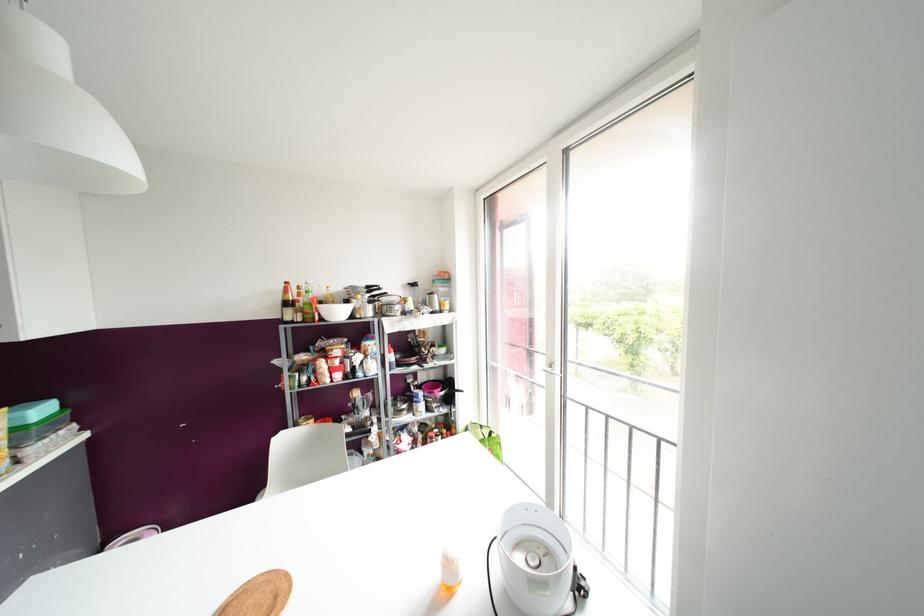
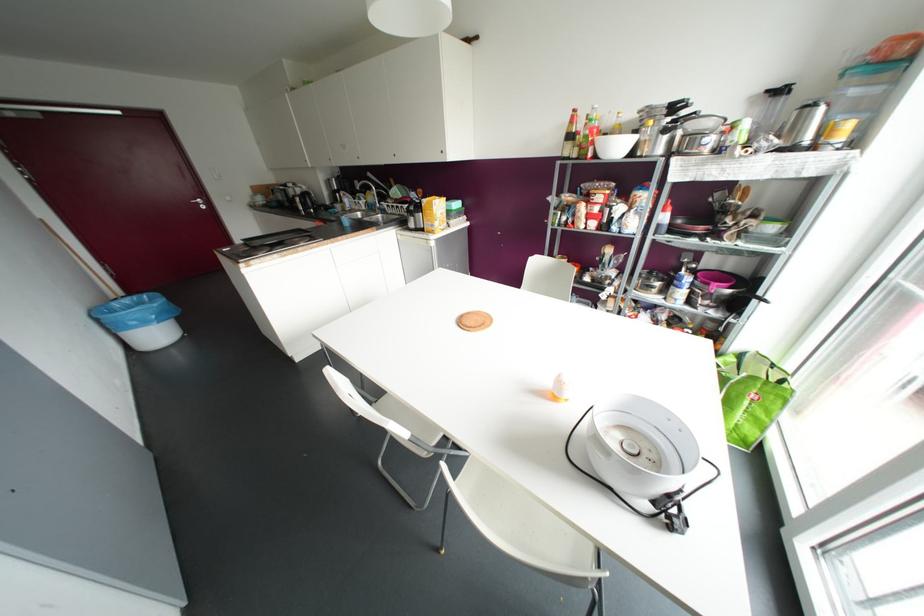
Locate, in the second image, the point that corresponds to (286,282) in the first image.

(574, 110)